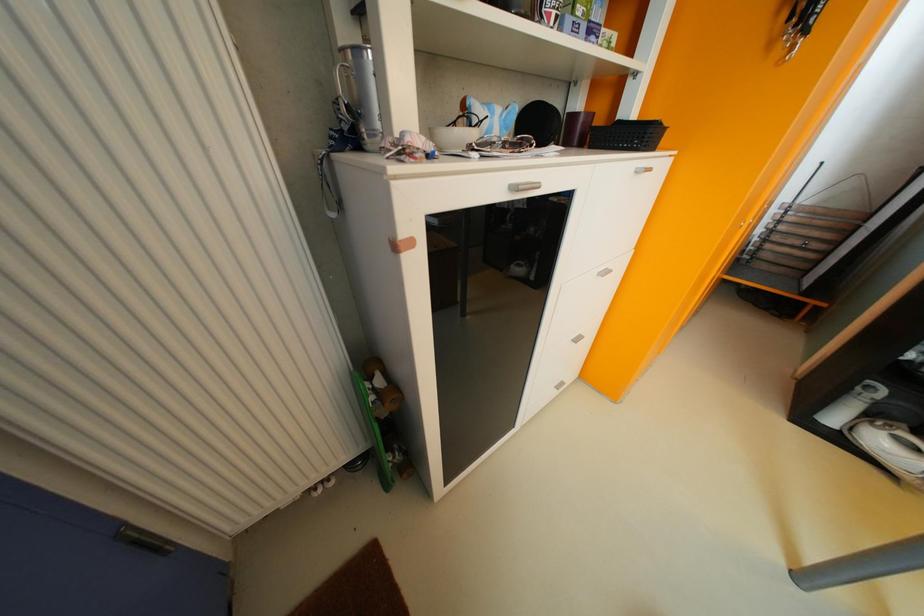
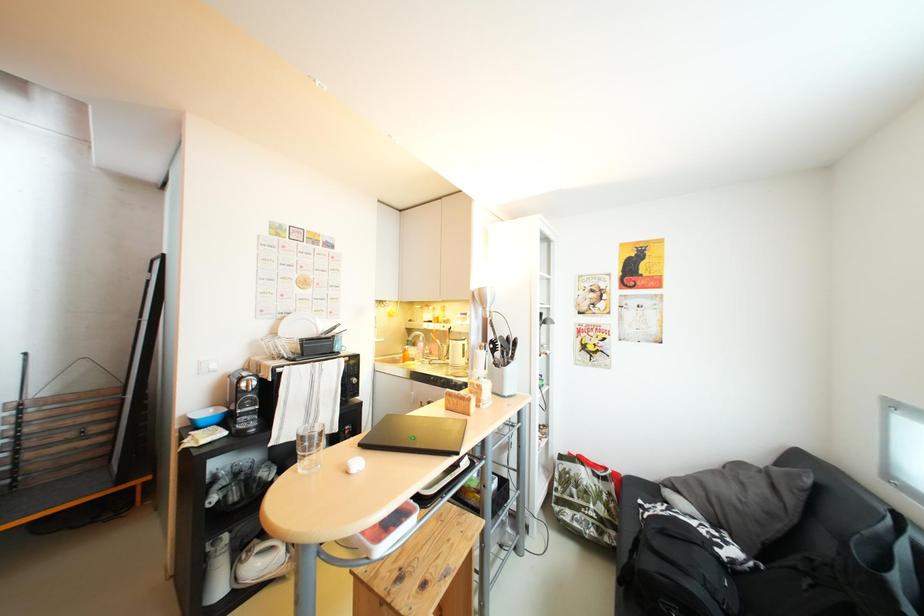
Question: The camera is either moving clockwise (left) or counter-clockwise (right) around the object. The first image is from the beginning of the video and the second image is from the end. Is the camera moving left or right when shooting the video?

Choices:
 (A) Left
 (B) Right

Answer: (A)